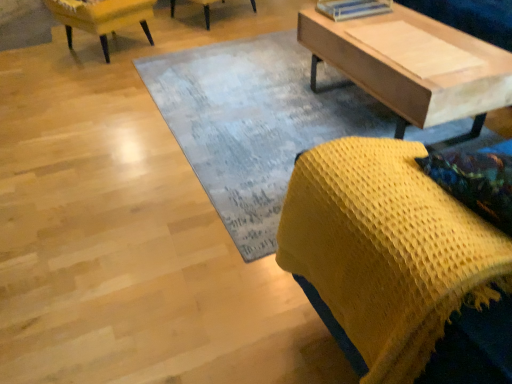
I want to click on vacant area situated below yellow fabric chair at upper left, which is the first chair in top-to-bottom order (from a real-world perspective), so click(x=113, y=48).